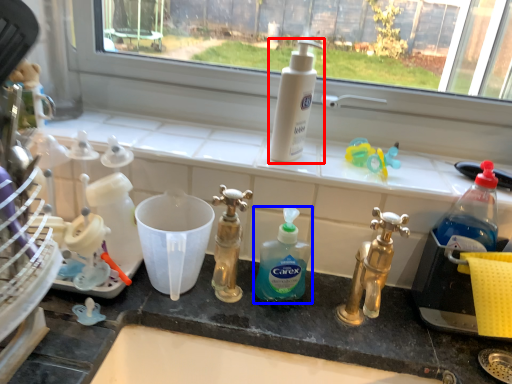
Question: Which object is further to the camera taking this photo, cleaning product (highlighted by a red box) or cleaning product (highlighted by a blue box)?

Choices:
 (A) cleaning product
 (B) cleaning product

Answer: (A)